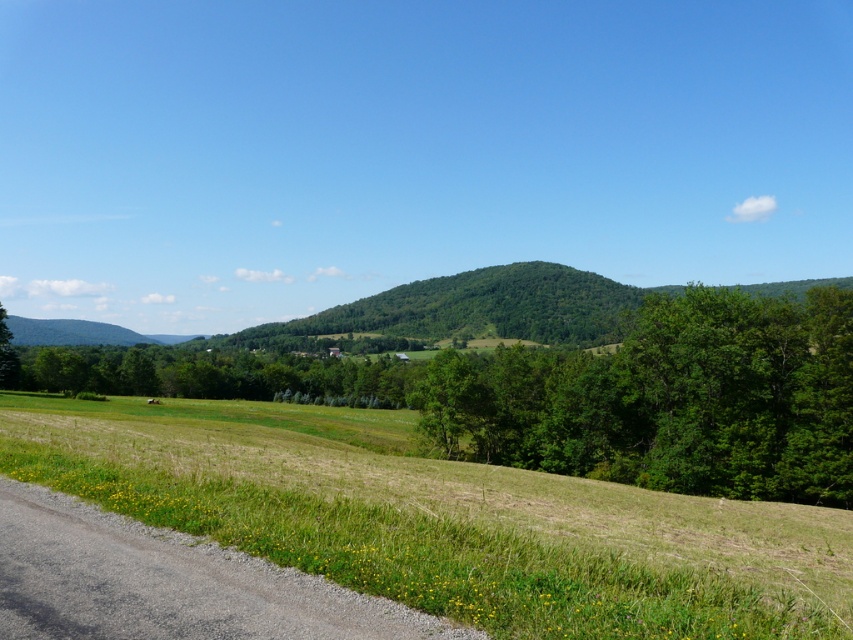
Question: Is green leafy tree at center below green leafy hill at center?

Choices:
 (A) no
 (B) yes

Answer: (B)

Question: Among these objects, which one is farthest from the camera?

Choices:
 (A) green leafy tree at center
 (B) green leafy hill at center

Answer: (B)

Question: Is green leafy tree at center thinner than green leafy hill at center?

Choices:
 (A) no
 (B) yes

Answer: (B)

Question: Which object appears farthest from the camera in this image?

Choices:
 (A) green leafy hill at center
 (B) green leafy tree at center

Answer: (A)

Question: Which point is closer to the camera?

Choices:
 (A) green leafy tree at center
 (B) green leafy hill at center

Answer: (A)

Question: Does green leafy tree at center appear on the right side of green leafy hill at center?

Choices:
 (A) no
 (B) yes

Answer: (B)